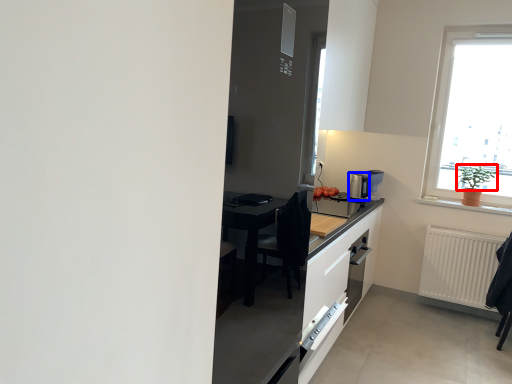
Question: Which of the following is the closest to the observer, plant (highlighted by a red box) or coffee machine (highlighted by a blue box)?

Choices:
 (A) plant
 (B) coffee machine

Answer: (A)